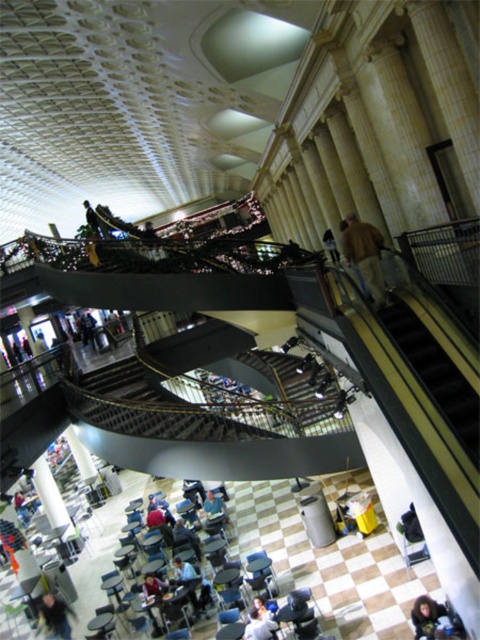
structural integrity of the staircase railing is a concern. If the dark blue jeans at lower left is under dark blue jeans at lower center, which one is closer to the staircase railing?

structural integrity of the staircase railing is a concern. If the dark blue jeans at lower left is under dark blue jeans at lower center, which one is closer to the staircase railing? The dark blue jeans at lower left is positioned under dark blue jeans at lower center, so the dark blue jeans at lower left is closer to the staircase railing.